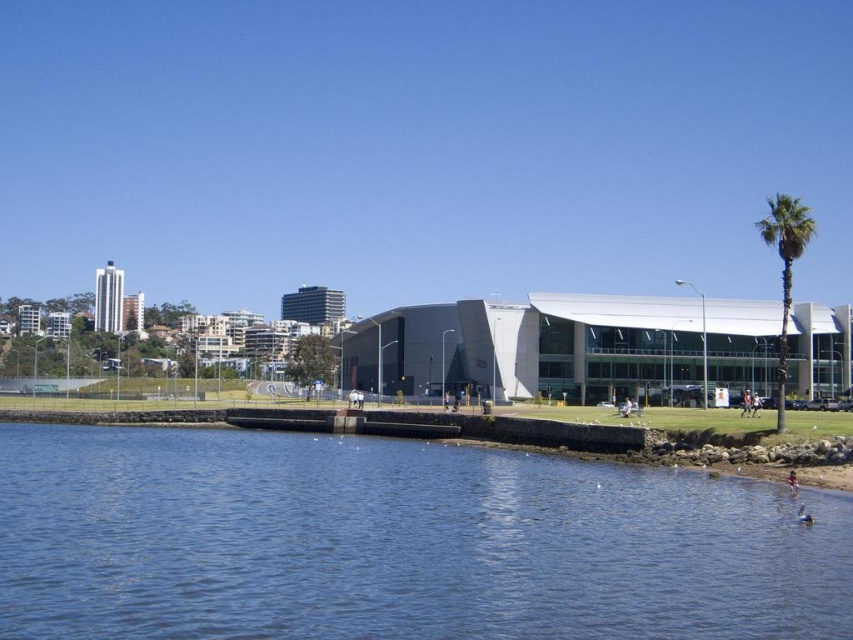
You are standing at the entrance of the building and want to take a photo of the blue water at lower left and the green leafy palm tree at right. Which object should you frame first in your camera viewfinder to ensure both are in the shot?

You should frame the blue water at lower left first because it is positioned to the left of the green leafy palm tree at right, so starting with the left side ensures both objects are included in the photo.

You are standing in front of the modern building and want to know if the blue water at lower left is taller than the green leafy palm tree at right. Based on the scene, what can you conclude?

The blue water at lower left is not as tall as the green leafy palm tree at right, so the palm tree is taller than the water in this view.